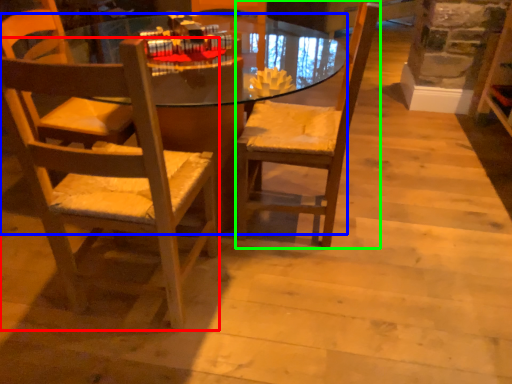
Question: Which object is the farthest from chair (highlighted by a red box)? Choose among these: desk (highlighted by a blue box) or chair (highlighted by a green box).

Choices:
 (A) desk
 (B) chair

Answer: (A)